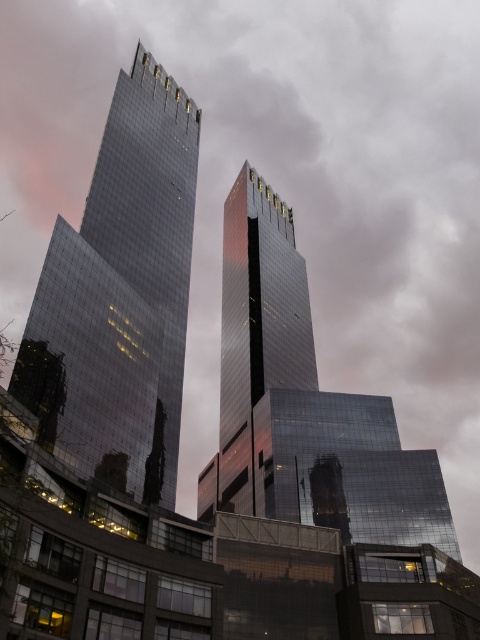
You are an architect analyzing the layout of two buildings in the image. Which of the two shiny glass structures, the shiny glass tower at center or the shiny glass skyscraper at center, is positioned to the east if the sun is setting to the west?

The shiny glass tower at center is to the left of the shiny glass skyscraper at center. Since the sun is setting to the west, the structure further east would be the one casting a shadow towards the west. However, based on the description, the shiny glass tower at center is positioned to the left of the skyscraper. Assuming left corresponds to east in this orientation, the shiny glass tower at center would be east of the skyscraper. Therefore, the shiny glass tower at center is positioned to the east.

You are an architect evaluating the design of two buildings in the image. Given that the shiny glass tower at center and the shiny glass skyscraper at center are both central to the composition, which one has a narrower structure?

The shiny glass tower at center has a narrower structure since its width is less than that of the shiny glass skyscraper at center.